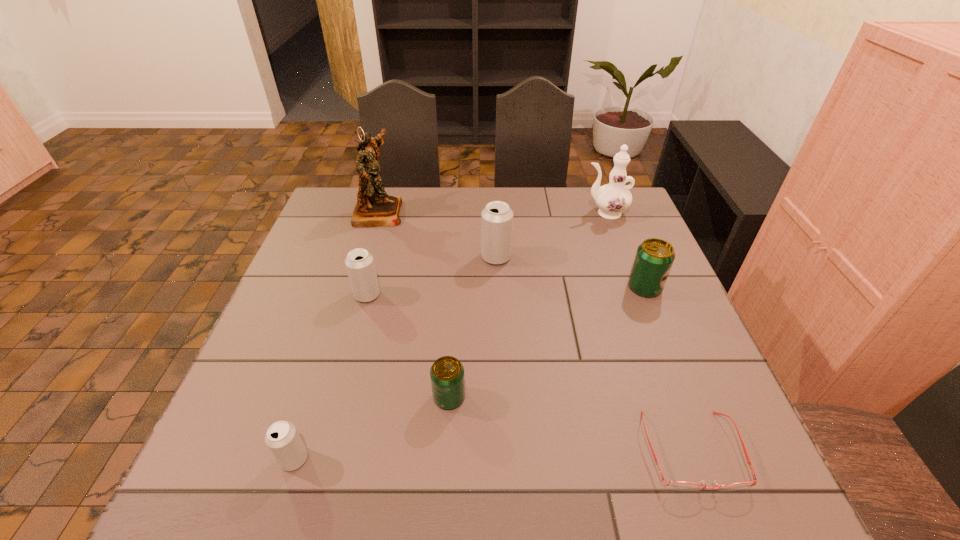
In order to click on the smallest white beer can in this screenshot , I will do `click(282, 438)`.

This screenshot has height=540, width=960. In order to click on the nearest beer can in this screenshot , I will do `click(282, 438)`.

What are the coordinates of `spectacles` in the screenshot? It's located at (676, 485).

Locate an element on the screen. Image resolution: width=960 pixels, height=540 pixels. the shortest object is located at coordinates (676, 485).

The width and height of the screenshot is (960, 540). I want to click on vacant space located 0.340m on the front-facing side of the tallest object, so (x=510, y=212).

I want to click on blank area located at the spout of the chinaware, so click(541, 213).

You are a GUI agent. You are given a task and a screenshot of the screen. Output one action in this format:
    pyautogui.click(x=<x>, y=<y>)
    Task: Click on the free space located at the spout of the chinaware
    
    Given the screenshot: What is the action you would take?
    pyautogui.click(x=525, y=213)

Locate an element on the screen. The width and height of the screenshot is (960, 540). vacant space located at the spout of the chinaware is located at coordinates (547, 213).

Find the location of a particular element. free space located 0.080m on the front of the rightmost white beer can is located at coordinates (497, 287).

Where is `free space located 0.150m on the right of the second nearest white beer can`? The width and height of the screenshot is (960, 540). free space located 0.150m on the right of the second nearest white beer can is located at coordinates (439, 295).